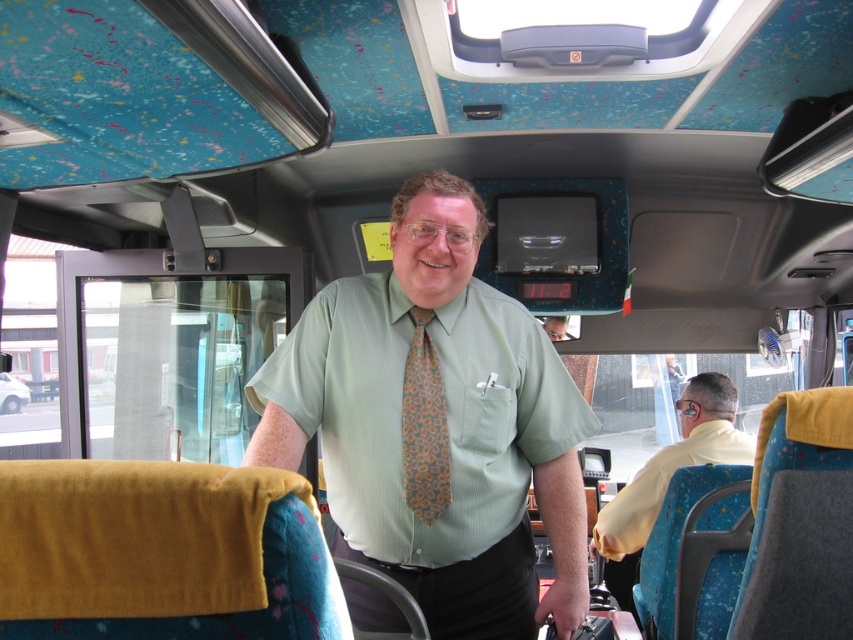
You are a passenger on the bus and want to see the small screen showing the number 112. The yellow shirt at right and orange patterned tie at center are blocking your view. Which object should you move to get a better view?

You should move the orange patterned tie at center because it is behind the yellow shirt at right, so moving it would allow you to see the screen.

You are a passenger on the bus and want to identify the man at the front. Which item is positioned lower on his body between the green textured shirt at center and the orange patterned tie at center?

The green textured shirt at center is located below the orange patterned tie at center, so it is positioned lower on his body.